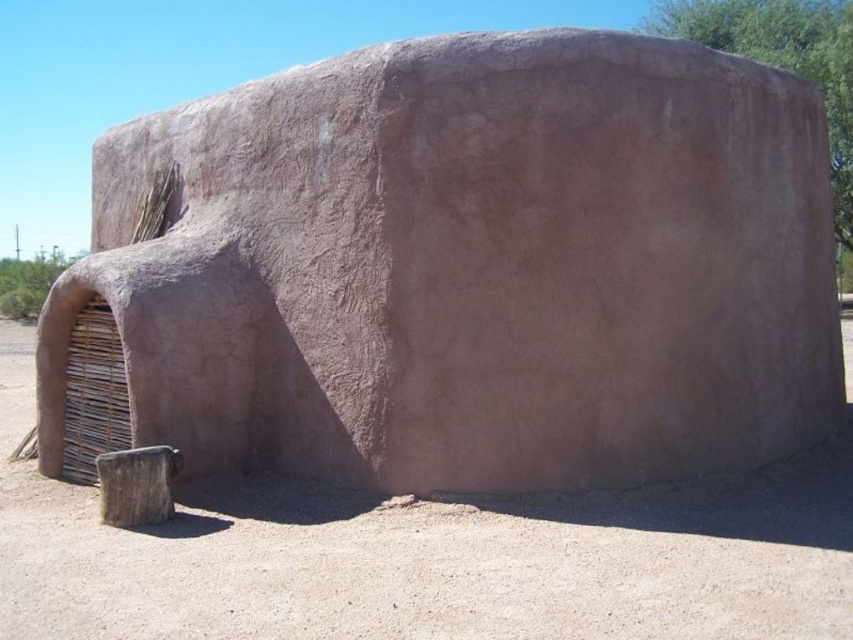
Question: Is brown clay structure at center bigger than brown rough wood stump at lower left?

Choices:
 (A) no
 (B) yes

Answer: (A)

Question: Which of the following is the farthest from the observer?

Choices:
 (A) (328, 269)
 (B) (149, 474)

Answer: (A)

Question: Which point is closer to the camera?

Choices:
 (A) (334, 419)
 (B) (123, 490)

Answer: (B)

Question: Can you confirm if brown clay structure at center is thinner than brown rough wood stump at lower left?

Choices:
 (A) no
 (B) yes

Answer: (B)

Question: Which of the following is the closest to the observer?

Choices:
 (A) (149, 456)
 (B) (788, 170)

Answer: (A)

Question: Can you confirm if brown clay structure at center is positioned to the right of brown rough wood stump at lower left?

Choices:
 (A) yes
 (B) no

Answer: (A)